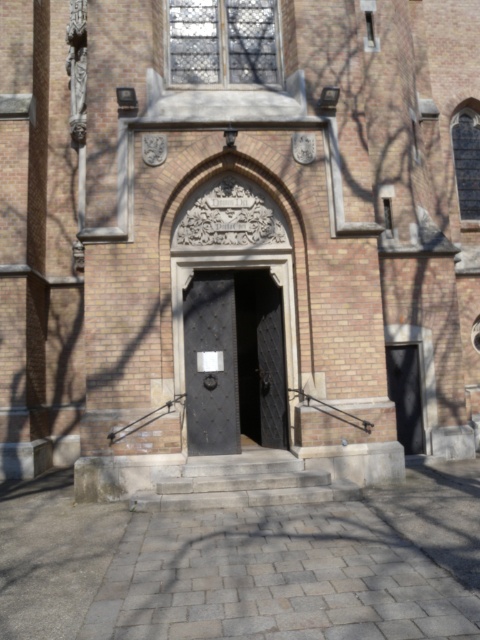
You are a delivery person with a large box that measures 3 meters in length. You need to move the box through the entrance. Can you fit the box between the black textured door at center and the black matte door at right?

The distance between the black textured door at center and the black matte door at right is 2.73 meters, which is shorter than the box length of 3 meters. Therefore, the box cannot fit through the entrance.

You are standing at the entrance of the building and want to determine the spatial relationship between two points marked in the scene. Which point, point (x=204, y=348) or point (x=408, y=410), is closer to you?

Point (x=204, y=348) is closer to the viewer than point (x=408, y=410).

You are a delivery person trying to deliver a package to the building. You have two doors in front of you, the black textured door at center and the black matte door at right. Which door is wider and more suitable for carrying a large package?

The black textured door at center is wider than the black matte door at right, making it more suitable for carrying a large package.